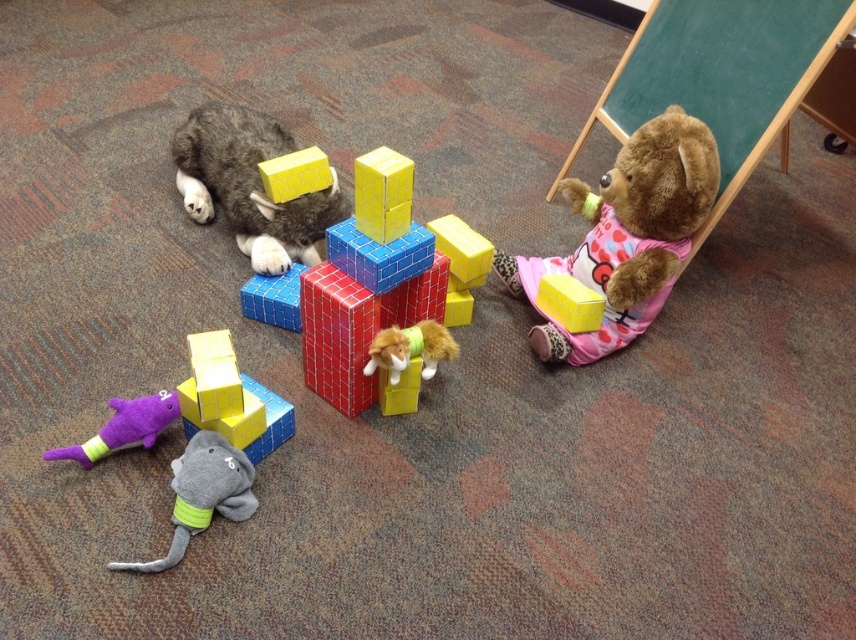
Does fuzzy gray cat at upper left have a greater height compared to purple plush toy at lower left?

Yes.

Is point (227, 112) farther from camera compared to point (149, 408)?

Yes, it is behind point (149, 408).

Does point (203, 163) come behind point (86, 460)?

Yes, it is behind point (86, 460).

Locate an element on the screen. fuzzy gray cat at upper left is located at coordinates (x=250, y=186).

Between point (251, 416) and point (233, 518), which one is positioned in front?

Point (251, 416) is more forward.

Is point (205, 369) in front of point (185, 452)?

That is True.

This screenshot has width=856, height=640. Find the location of `matte yellow cube at center`. matte yellow cube at center is located at coordinates (230, 397).

Does fuzzy gray cat at upper left appear under yellow matte block at center?

No.

Does fuzzy gray cat at upper left come behind yellow matte block at center?

Yes.

Is point (312, 262) more distant than point (574, 300)?

That is True.

At what (x,y) coordinates should I click in order to perform the action: click on fuzzy gray cat at upper left. Please return your answer as a coordinate pair (x, y). Looking at the image, I should click on (250, 186).